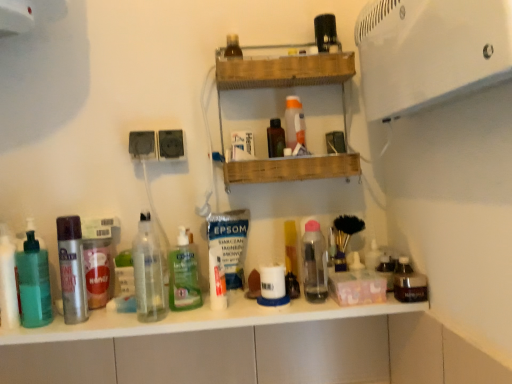
You are a GUI agent. You are given a task and a screenshot of the screen. Output one action in this format:
    pyautogui.click(x=<x>, y=<y>)
    Task: Click on the free space to the right of silver metallic spray can at left, marked as the fourth bottle in a right-to-left arrangement
    
    Given the screenshot: What is the action you would take?
    pyautogui.click(x=127, y=323)